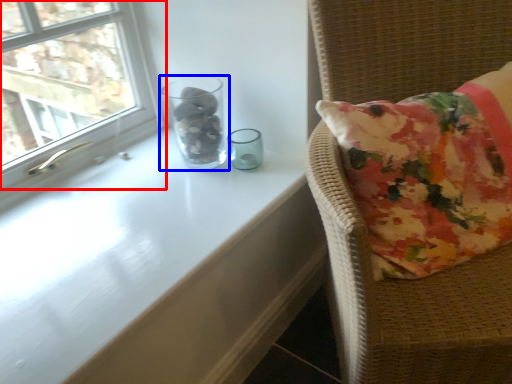
Question: Which object is closer to the camera taking this photo, window (highlighted by a red box) or glass vase (highlighted by a blue box)?

Choices:
 (A) window
 (B) glass vase

Answer: (A)